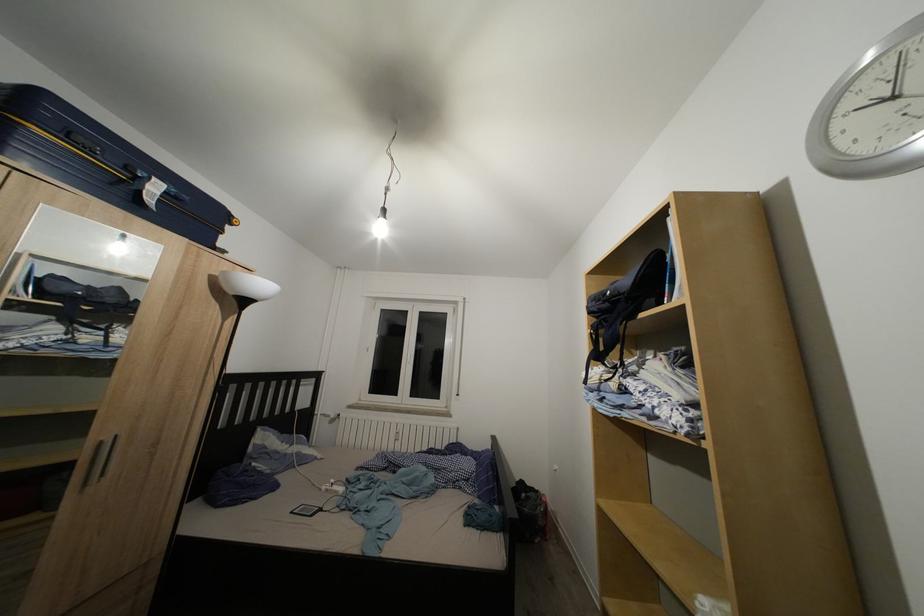
Image resolution: width=924 pixels, height=616 pixels. What do you see at coordinates (136, 172) in the screenshot?
I see `the blue suitcase handle` at bounding box center [136, 172].